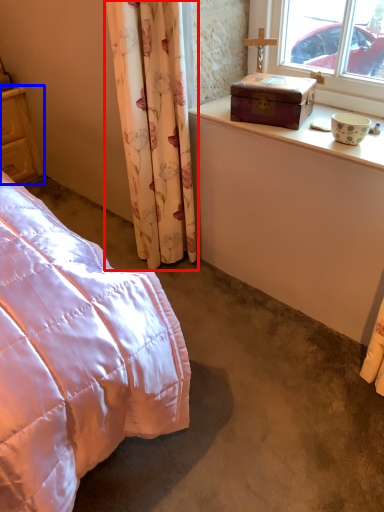
Question: Which object appears closest to the camera in this image, curtain (highlighted by a red box) or cupboard (highlighted by a blue box)?

Choices:
 (A) curtain
 (B) cupboard

Answer: (A)